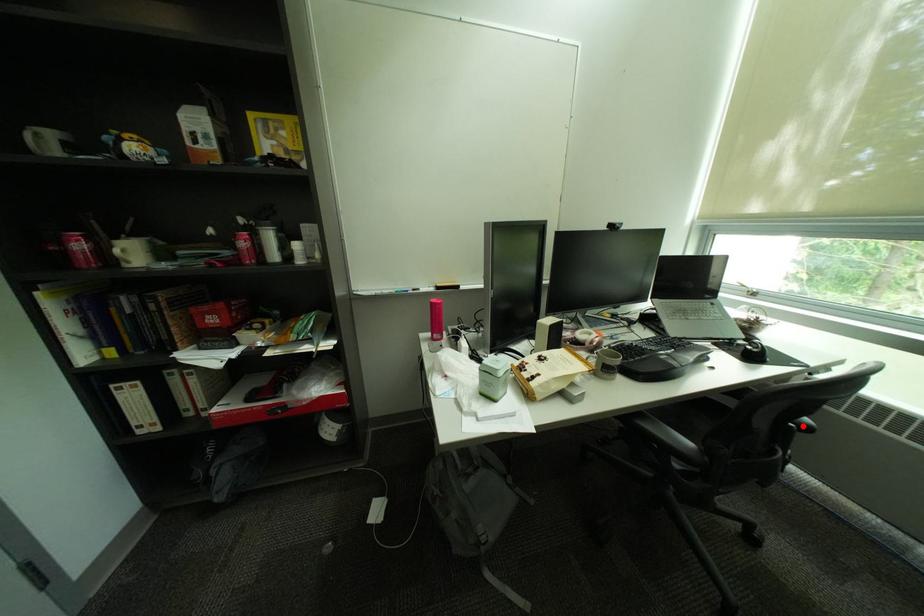
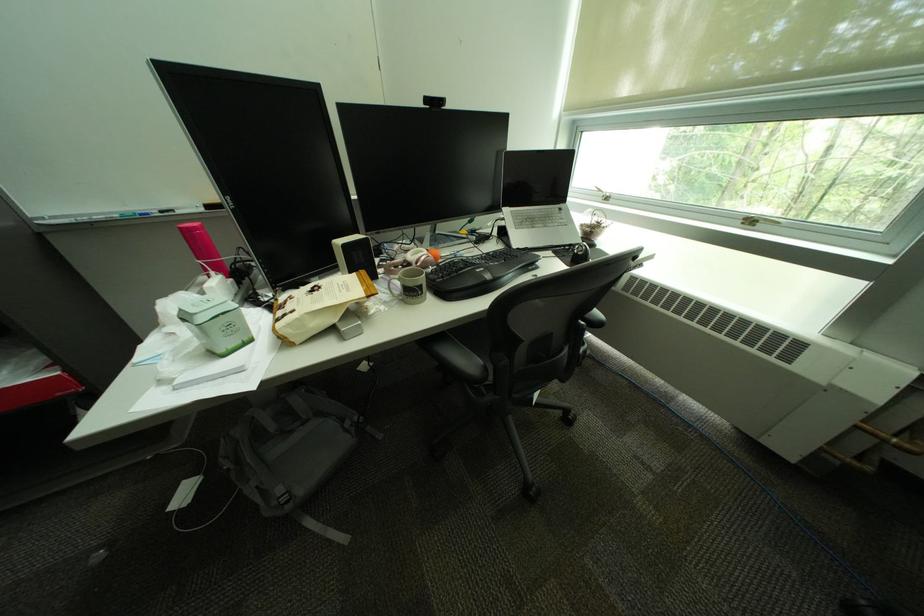
Where in the second image is the point corresponding to the highlighted location from the first image?

(593, 323)